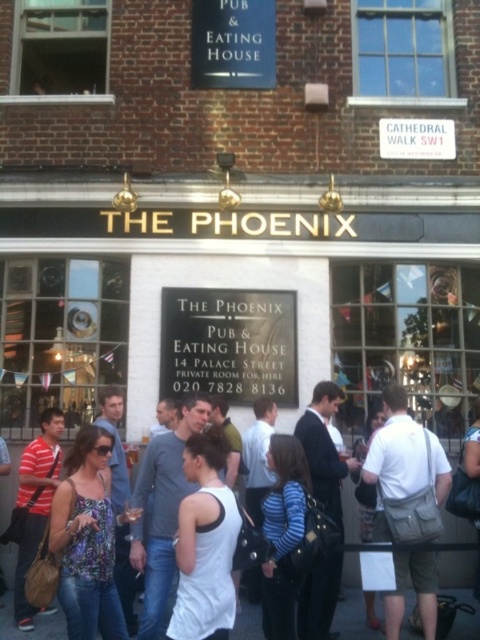
You are standing in front of The Phoenix pub and notice a metallic signboard at center and a white cotton tank top at center. Which object is closer to you?

The metallic signboard at center is closer to you because it is further to the viewer than the white cotton tank top at center.